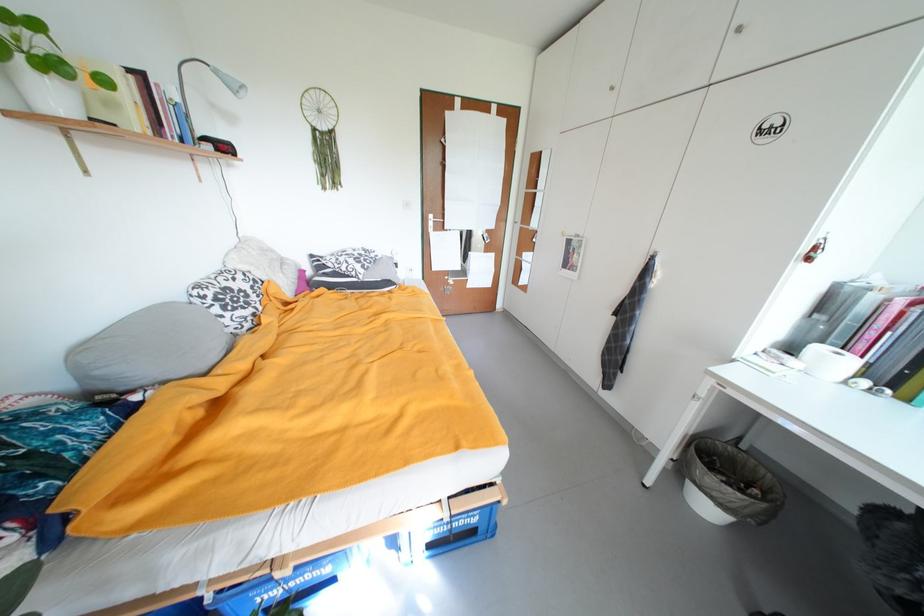
Where would you lift the grey pillow? Please return your answer as a coordinate pair (x, y).

(149, 349)